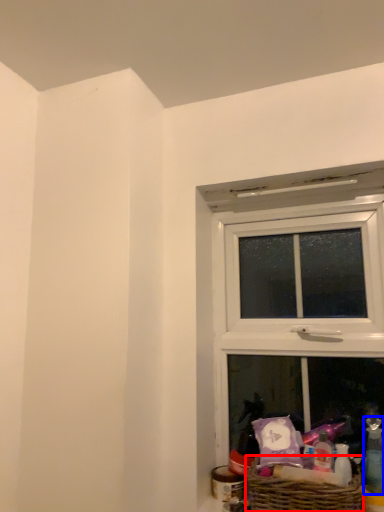
Question: Which object appears farthest to the camera in this image, picnic basket (highlighted by a red box) or toiletry (highlighted by a blue box)?

Choices:
 (A) picnic basket
 (B) toiletry

Answer: (B)